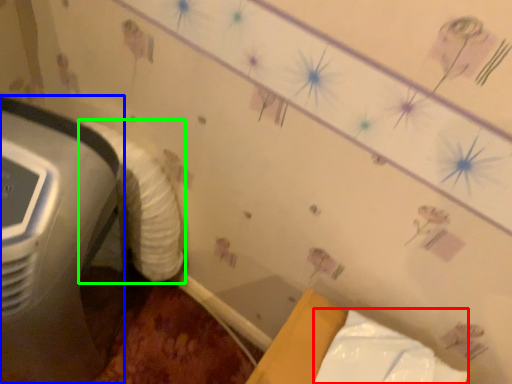
Question: Estimate the real-world distances between objects in this image. Which object is closer to wrapping paper (highlighted by a red box), home appliance (highlighted by a blue box) or sheet (highlighted by a green box)?

Choices:
 (A) home appliance
 (B) sheet

Answer: (B)